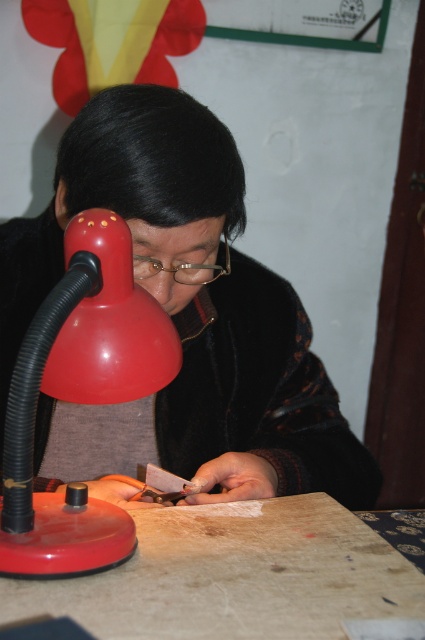
Question: Is wooden table at lower center to the right of metallic silver tool at center from the viewer's perspective?

Choices:
 (A) yes
 (B) no

Answer: (A)

Question: Among these points, which one is nearest to the camera?

Choices:
 (A) (150, 428)
 (B) (167, 476)
 (C) (34, 595)
 (D) (156, 371)

Answer: (C)

Question: Considering the real-world distances, which object is closest to the metallic silver tool at center?

Choices:
 (A) matte plastic desk lamp at left
 (B) matte black jacket at center
 (C) wooden table at lower center

Answer: (C)

Question: Based on their relative distances, which object is nearer to the matte black jacket at center?

Choices:
 (A) matte plastic desk lamp at left
 (B) wooden table at lower center

Answer: (B)

Question: Does matte black jacket at center come behind matte plastic desk lamp at left?

Choices:
 (A) yes
 (B) no

Answer: (A)

Question: Can you confirm if wooden table at lower center is thinner than matte plastic desk lamp at left?

Choices:
 (A) no
 (B) yes

Answer: (A)